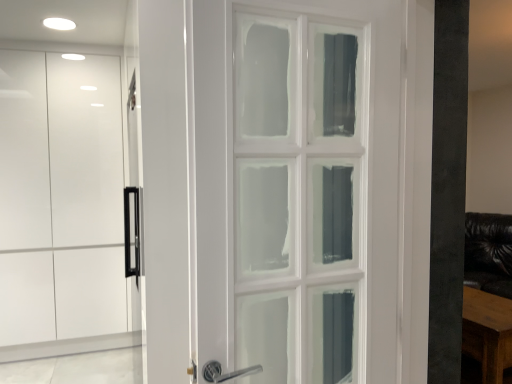
I want to click on white glossy barn door at left, so click(x=62, y=208).

Measure the distance between point (64, 148) and camera.

Point (64, 148) is 3.18 meters away from camera.

What do you see at coordinates (62, 208) in the screenshot?
I see `white glossy barn door at left` at bounding box center [62, 208].

At what (x,y) coordinates should I click in order to perform the action: click on white glossy barn door at left. Please return your answer as a coordinate pair (x, y). Looking at the image, I should click on (62, 208).